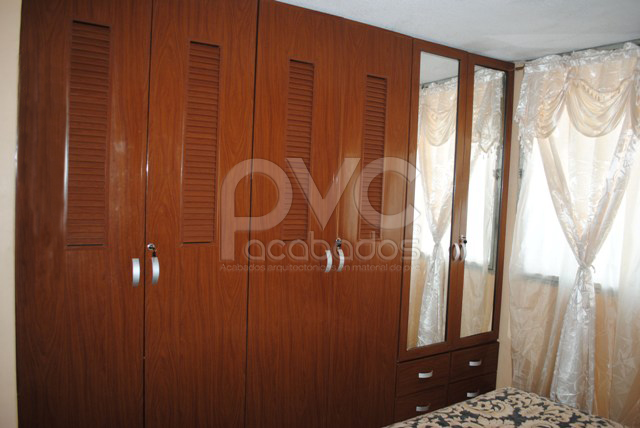
Image resolution: width=640 pixels, height=428 pixels. I want to click on space between mirror and drawers, so click(x=436, y=355), click(x=467, y=347).